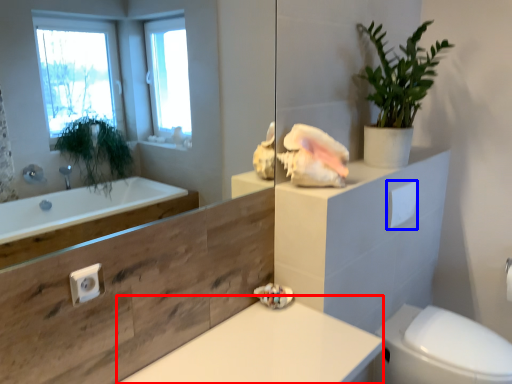
Question: Which of the following is the closest to the observer, counter top (highlighted by a red box) or toilet paper (highlighted by a blue box)?

Choices:
 (A) counter top
 (B) toilet paper

Answer: (A)